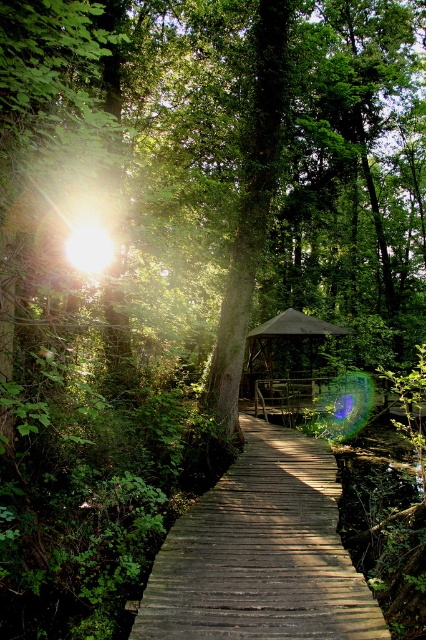
You are a hiker who wants to reach the dark gray fabric gazebo at center. You are currently standing on the wooden planks at center. Which direction should you move to get to the gazebo?

The wooden planks at center is positioned on the left side of the dark gray fabric gazebo at center, so you should move to the right to reach the gazebo.

You are a hiker who wants to rest under the gazebo. You see the wooden planks at center and the dark gray fabric gazebo at center. Which object is larger?

The dark gray fabric gazebo at center is larger than the wooden planks at center.

You are standing at the start of the wooden boardwalk in the forest scene. You want to know how far the wooden planks at center are from your current position. Can you determine the distance?

The wooden planks at center are 5.19 meters away from the viewer.